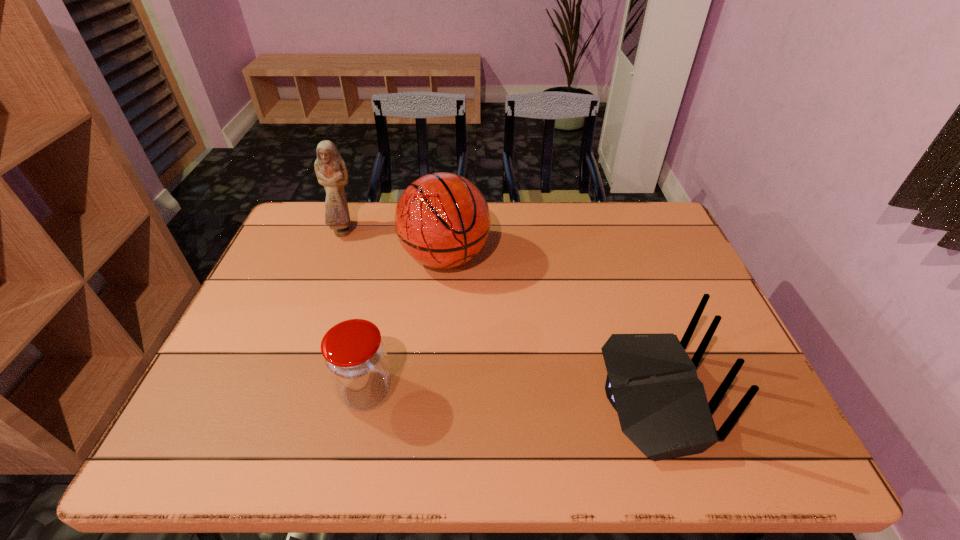
Find the location of a particular element. Image resolution: width=960 pixels, height=540 pixels. vacant space at the left edge of the desktop is located at coordinates (249, 352).

At what (x,y) coordinates should I click in order to perform the action: click on free space at the right edge of the desktop. Please return your answer as a coordinate pair (x, y). Looking at the image, I should click on (684, 256).

In order to click on free space at the far left corner of the desktop in this screenshot , I will do `click(313, 231)`.

Image resolution: width=960 pixels, height=540 pixels. In the image, there is a desktop. Identify the location of free space at the near left corner. (232, 390).

Locate an element on the screen. The height and width of the screenshot is (540, 960). vacant area that lies between the figurine and the basketball is located at coordinates (395, 244).

Identify the location of empty location between the basketball and the rightmost object. This screenshot has height=540, width=960. (548, 327).

In order to click on empty space that is in between the jar and the rightmost object in this screenshot , I will do `click(509, 394)`.

The width and height of the screenshot is (960, 540). I want to click on blank region between the jar and the rightmost object, so click(509, 394).

Where is `free point between the basketball and the router`? The image size is (960, 540). free point between the basketball and the router is located at coordinates (548, 327).

Find the location of `vacant area between the basketball and the leftmost object`. vacant area between the basketball and the leftmost object is located at coordinates (395, 244).